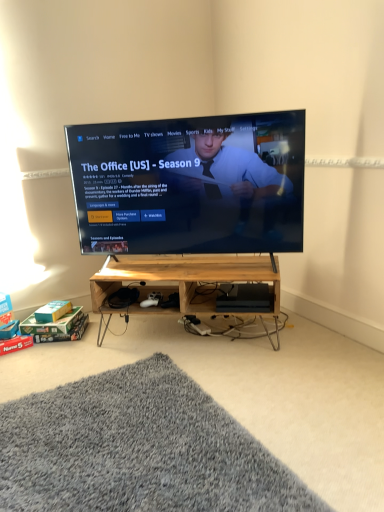
The width and height of the screenshot is (384, 512). I want to click on free space to the left of wooden at center, the 1th shelf when ordered from bottom to top, so point(71,361).